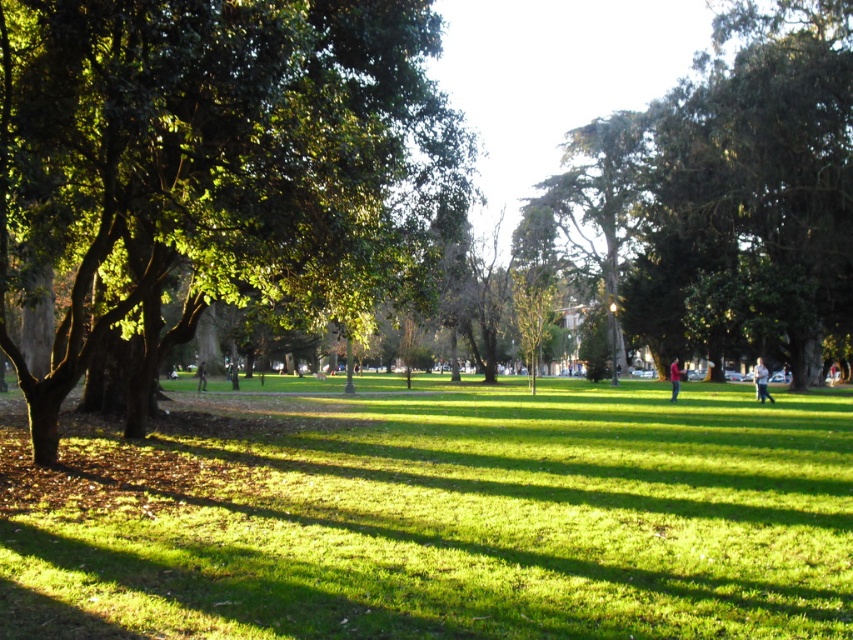
You are standing at the park entrance and want to locate the green leafy tree at center. According to the coordinates provided, where should you look relative to the park entrance?

The green leafy tree at center is located at coordinates point (215, 172), which means it is positioned slightly to the left and forward from the park entrance.

You are standing at the camera position and want to reach the point at coordinates (x=202, y=365) in the park. The park has a rule that you can only walk in straight lines and cannot exceed a distance of 60 meters. Can you reach the point without breaking the rule?

The distance between you and the point at coordinates (x=202, y=365) is 60.21 meters, which exceeds the park rule of 60 meters. Therefore, you cannot reach the point without breaking the rule.